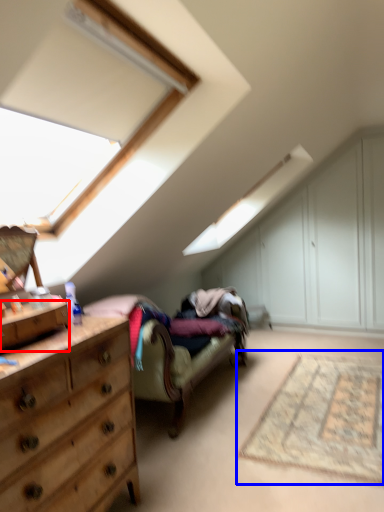
Question: Which object appears farthest to the camera in this image, drawer (highlighted by a red box) or mat (highlighted by a blue box)?

Choices:
 (A) drawer
 (B) mat

Answer: (B)